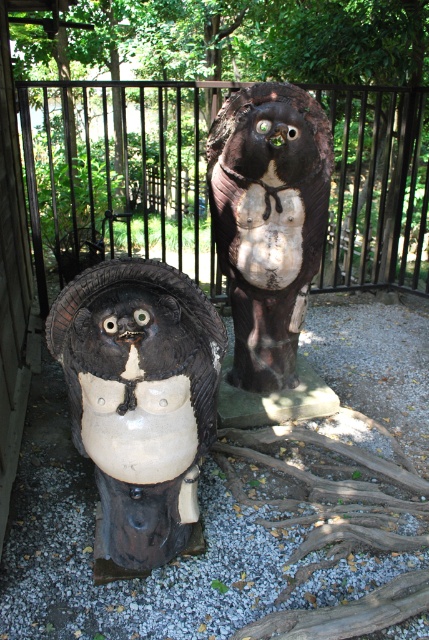
Who is shorter, black metal fence at upper center or wooden owl at center?

Standing shorter between the two is wooden owl at center.

Is black metal fence at upper center in front of wooden owl at center?

No.

In order to click on black metal fence at upper center in this screenshot , I will do `click(117, 177)`.

Locate an element on the screen. Image resolution: width=429 pixels, height=640 pixels. black metal fence at upper center is located at coordinates (117, 177).

Does black metal fence at upper center appear over matte black owl at center?

Yes, black metal fence at upper center is above matte black owl at center.

Can you confirm if black metal fence at upper center is positioned to the right of matte black owl at center?

Incorrect, black metal fence at upper center is not on the right side of matte black owl at center.

This screenshot has height=640, width=429. What do you see at coordinates (117, 177) in the screenshot?
I see `black metal fence at upper center` at bounding box center [117, 177].

I want to click on black metal fence at upper center, so click(x=117, y=177).

Who is higher up, wooden owl at center or matte black owl at center?

matte black owl at center is above.

Does wooden owl at center appear over matte black owl at center?

Incorrect, wooden owl at center is not positioned above matte black owl at center.

This screenshot has height=640, width=429. What are the coordinates of `wooden owl at center` in the screenshot? It's located at (139, 397).

You are a GUI agent. You are given a task and a screenshot of the screen. Output one action in this format:
    pyautogui.click(x=<x>, y=<y>)
    Task: Click on the wooden owl at center
    
    Given the screenshot: What is the action you would take?
    pyautogui.click(x=139, y=397)